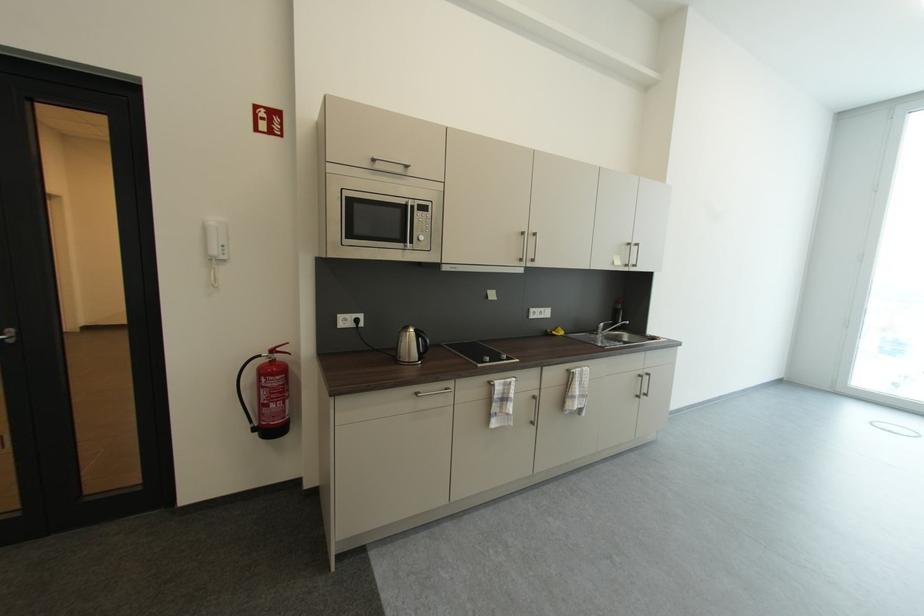
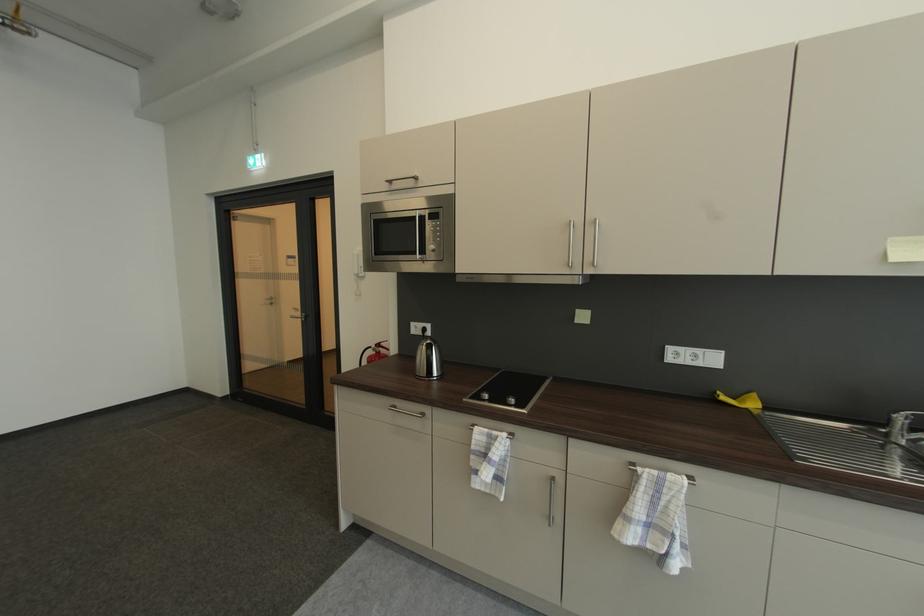
Find the pixel in the second image that matches [280,352] in the first image.

(384, 347)